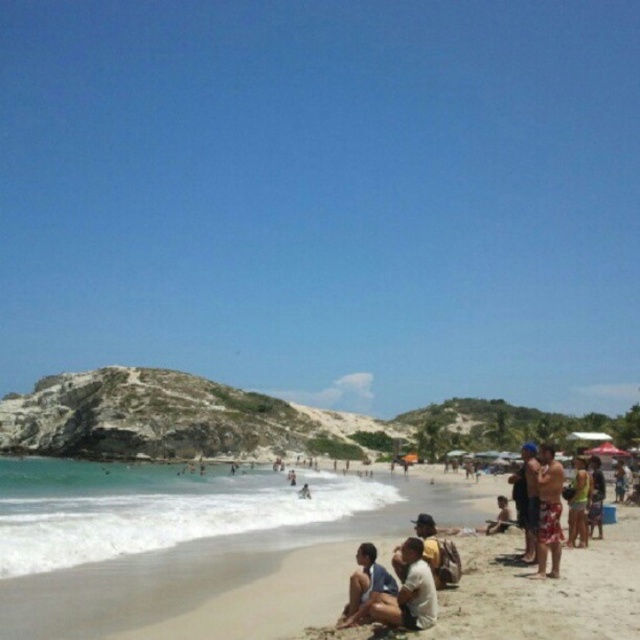
Question: From the image, what is the correct spatial relationship of clear blue water at lower left in relation to tan fabric shorts at lower right?

Choices:
 (A) below
 (B) above

Answer: (A)

Question: Among these points, which one is farthest from the camera?

Choices:
 (A) (541, 458)
 (B) (572, 506)

Answer: (B)

Question: Estimate the real-world distances between objects in this image. Which object is farther from the tan fabric shorts at lower right?

Choices:
 (A) matte white shirt at lower center
 (B) floral shorts at lower right
 (C) yellow fabric hat at lower center

Answer: (A)

Question: Is floral shorts at lower right bigger than yellow fabric hat at lower center?

Choices:
 (A) yes
 (B) no

Answer: (A)

Question: Which object is closer to the camera taking this photo?

Choices:
 (A) green fabric shorts at lower right
 (B) matte white shirt at lower center
 (C) tan fabric shorts at lower right

Answer: (B)

Question: Is matte white shirt at lower center closer to the viewer compared to floral shorts at lower right?

Choices:
 (A) yes
 (B) no

Answer: (A)